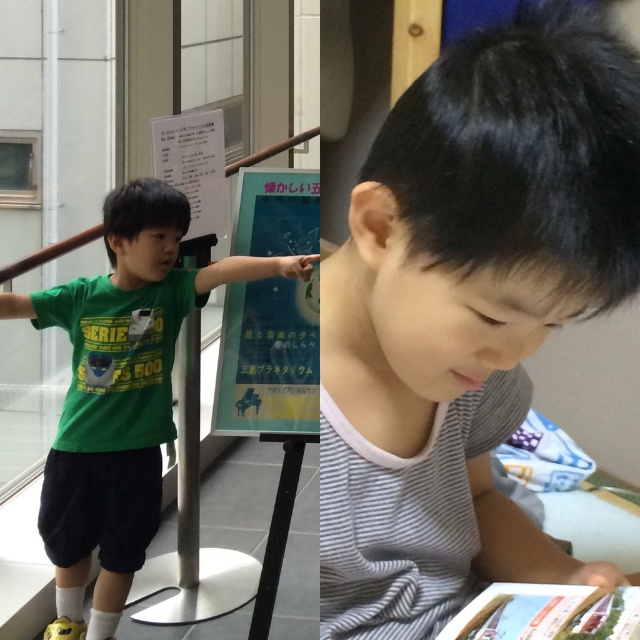
Question: Which of the following is the closest to the observer?

Choices:
 (A) (307, 177)
 (B) (448, 515)
 (C) (138, 364)

Answer: (B)

Question: Considering the real-world distances, which object is farthest from the gray striped shirt at center?

Choices:
 (A) green matte shirt at center
 (B) blue paper poster at center

Answer: (A)

Question: Does gray striped shirt at center have a greater width compared to green matte shirt at center?

Choices:
 (A) yes
 (B) no

Answer: (B)

Question: Is gray striped shirt at center further to the viewer compared to green matte shirt at center?

Choices:
 (A) no
 (B) yes

Answer: (A)

Question: Can you confirm if gray striped shirt at center is wider than green matte shirt at center?

Choices:
 (A) no
 (B) yes

Answer: (A)

Question: Considering the real-world distances, which object is farthest from the green matte shirt at center?

Choices:
 (A) blue paper poster at center
 (B) gray striped shirt at center

Answer: (B)